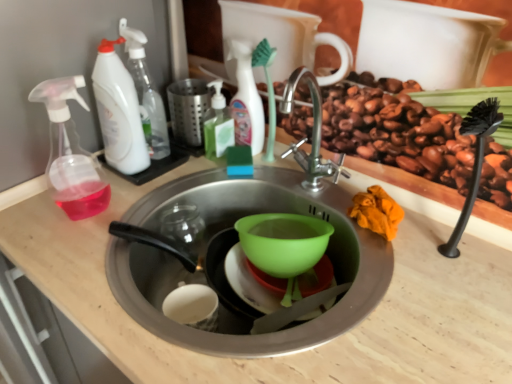
This screenshot has width=512, height=384. Identify the location of vacant area that is in front of white plastic spray bottle at upper left, the 1th cleaning product viewed from the left. (102, 197).